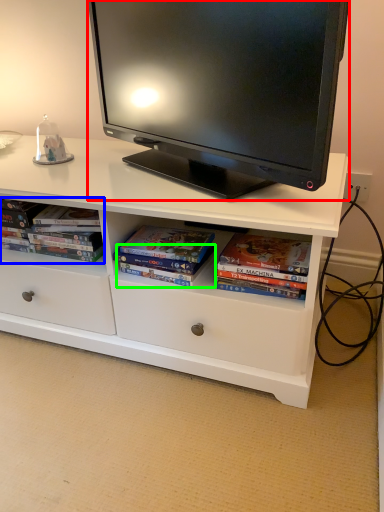
Question: Which object is the farthest from television (highlighted by a red box)? Choose among these: book (highlighted by a blue box) or paperback book (highlighted by a green box).

Choices:
 (A) book
 (B) paperback book

Answer: (B)